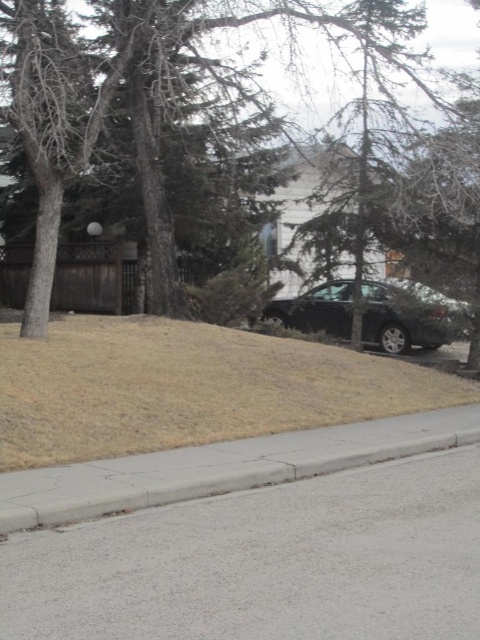
Is point (445, 401) more distant than point (434, 417)?

That is True.

This screenshot has width=480, height=640. Describe the element at coordinates (188, 387) in the screenshot. I see `brown dry grass at lower center` at that location.

Does point (8, 426) come in front of point (51, 476)?

No, (8, 426) is behind (51, 476).

Identify the location of brown dry grass at lower center. Image resolution: width=480 pixels, height=640 pixels. (188, 387).

Looking at this image, which is above, gray concrete curb at lower center or brown textured tree at center?

brown textured tree at center is above.

Who is more forward, [271,452] or [274,74]?

Positioned in front is point [271,452].

The image size is (480, 640). Identify the location of gray concrete curb at lower center. (220, 467).

Which is more to the left, brown textured tree at center or glossy black car at center?

brown textured tree at center is more to the left.

Is brown textured tree at center bigger than glossy black car at center?

Yes, brown textured tree at center is bigger than glossy black car at center.

Identify the location of brown textured tree at center. (309, 38).

The image size is (480, 640). Identify the location of brown textured tree at center. (309, 38).